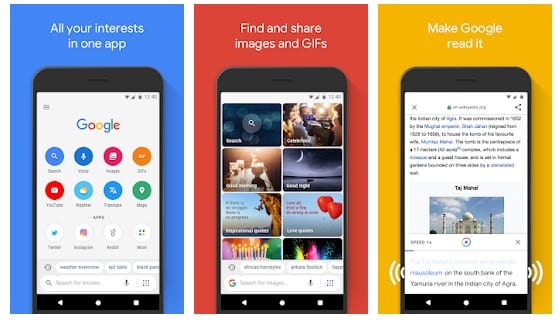
Identify the location of candles. (234, 250), (247, 250), (265, 250).